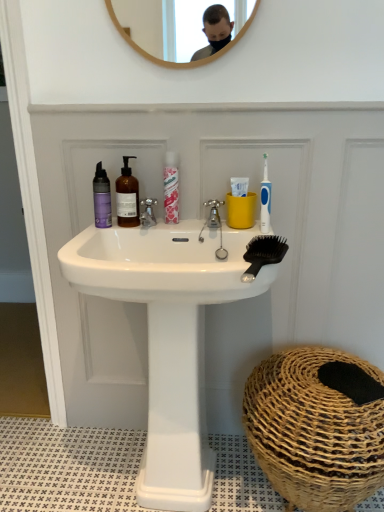
The width and height of the screenshot is (384, 512). What are the coordinates of `vacant space in between pink glossy mouthwash at center, which ranks as the 3th mouthwash in left-to-right order, and silver metallic tap at center, which is the 1th tap in right-to-left order` in the screenshot? It's located at (190, 225).